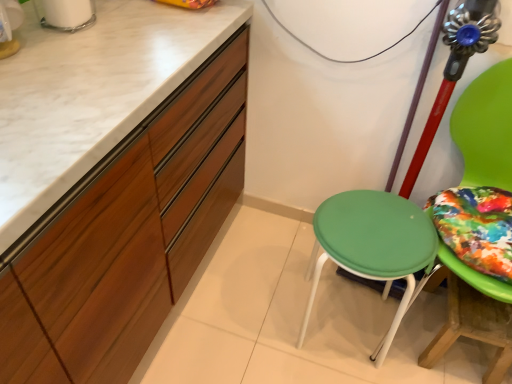
Question: Is green plastic stool at center located within matte wood cabinetry at left?

Choices:
 (A) yes
 (B) no

Answer: (B)

Question: Is matte wood cabinetry at left positioned with its back to green plastic stool at center?

Choices:
 (A) yes
 (B) no

Answer: (B)

Question: Is matte wood cabinetry at left at the right side of green plastic stool at center?

Choices:
 (A) no
 (B) yes

Answer: (A)

Question: Is matte wood cabinetry at left wider than green plastic stool at center?

Choices:
 (A) yes
 (B) no

Answer: (A)

Question: Can you confirm if matte wood cabinetry at left is thinner than green plastic stool at center?

Choices:
 (A) yes
 (B) no

Answer: (B)

Question: Considering the positions of matte wood cabinetry at left and green plastic stool at center in the image, is matte wood cabinetry at left taller or shorter than green plastic stool at center?

Choices:
 (A) short
 (B) tall

Answer: (B)

Question: Which is correct: matte wood cabinetry at left is inside green plastic stool at center, or outside of it?

Choices:
 (A) inside
 (B) outside

Answer: (B)

Question: Does point (200, 195) appear closer or farther from the camera than point (325, 200)?

Choices:
 (A) farther
 (B) closer

Answer: (B)

Question: In the image, is matte wood cabinetry at left on the left side or the right side of green plastic stool at center?

Choices:
 (A) left
 (B) right

Answer: (A)

Question: Is green plastic stool at center wider or thinner than matte wood cabinetry at left?

Choices:
 (A) thin
 (B) wide

Answer: (A)

Question: Does point (371, 218) appear closer or farther from the camera than point (158, 46)?

Choices:
 (A) closer
 (B) farther

Answer: (B)

Question: From the image's perspective, is green plastic stool at center above or below matte wood cabinetry at left?

Choices:
 (A) below
 (B) above

Answer: (A)

Question: From a real-world perspective, relative to matte wood cabinetry at left, is green plastic stool at center vertically above or below?

Choices:
 (A) above
 (B) below

Answer: (B)

Question: In the image, is green plastic stool at center positioned in front of or behind wooden table at lower right?

Choices:
 (A) behind
 (B) front

Answer: (B)

Question: Is green plastic stool at center wider or thinner than wooden table at lower right?

Choices:
 (A) thin
 (B) wide

Answer: (B)